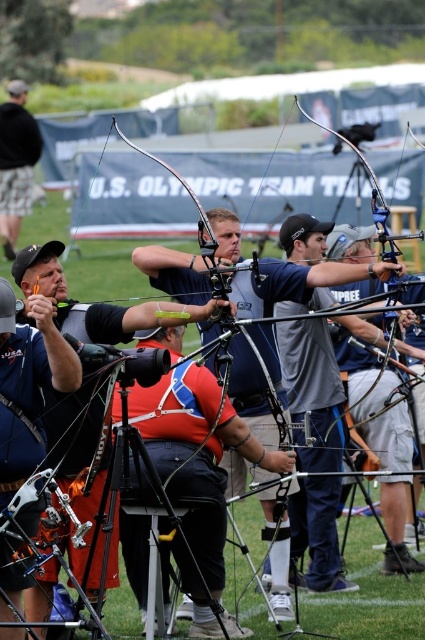
Can you confirm if matte black camera at left is positioned above black fabric jacket at upper left?

No, matte black camera at left is not above black fabric jacket at upper left.

Based on the photo, does matte black camera at left have a greater height compared to black fabric jacket at upper left?

No.

In order to click on matte black camera at left in this screenshot , I will do `click(28, 385)`.

Image resolution: width=425 pixels, height=640 pixels. Identify the location of matte black camera at left. (28, 385).